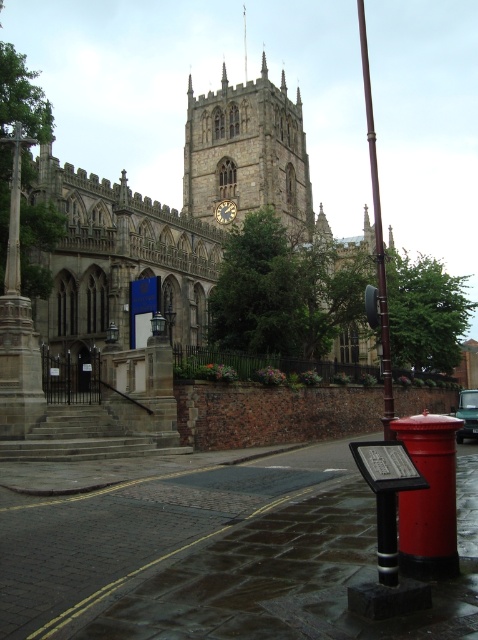
Looking at this image, can you confirm if stone gothic church at center is bigger than stone clock tower at center?

Yes.

Who is more distant from viewer, (202, 128) or (252, 209)?

Point (202, 128)

Which is behind, point (246, 172) or point (275, 132)?

Point (275, 132)

Locate an element on the screen. The image size is (478, 640). stone gothic church at center is located at coordinates (169, 240).

Consider the image. Between stone clock tower at center and green matte car at center, which one appears on the left side from the viewer's perspective?

stone clock tower at center is more to the left.

Does point (192, 109) come behind point (463, 401)?

Yes.

The height and width of the screenshot is (640, 478). I want to click on stone clock tower at center, so click(247, 154).

Does point (199, 164) come behind point (370, 154)?

No.

In the scene shown: Who is positioned more to the right, stone gothic church at center or smooth brown pole at right?

smooth brown pole at right

Who is more forward, (14, 410) or (383, 285)?

Positioned in front is point (383, 285).

Find the location of a particular element. Image resolution: width=478 pixels, height=640 pixels. stone gothic church at center is located at coordinates (169, 240).